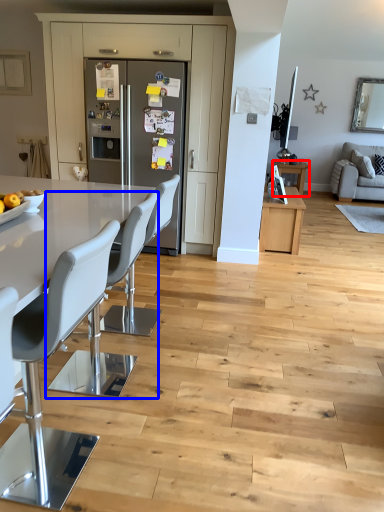
Question: Which of the following is the closest to the observer, table (highlighted by a red box) or chair (highlighted by a blue box)?

Choices:
 (A) table
 (B) chair

Answer: (B)